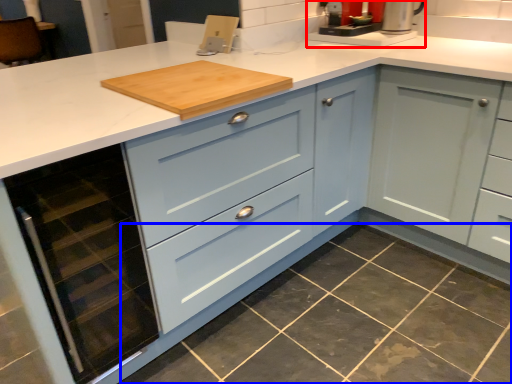
Question: Which object appears farthest to the camera in this image, coffee machine (highlighted by a red box) or granite (highlighted by a blue box)?

Choices:
 (A) coffee machine
 (B) granite

Answer: (A)